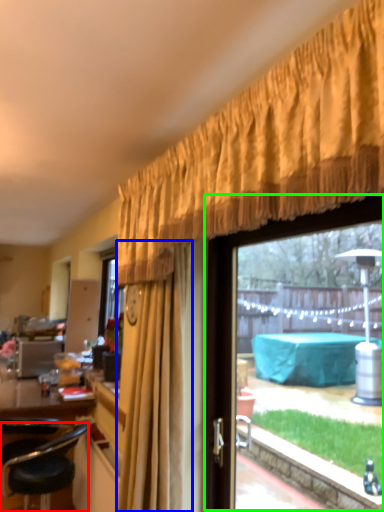
Question: Estimate the real-world distances between objects in this image. Which object is closer to chair (highlighted by a red box), curtain (highlighted by a blue box) or window (highlighted by a green box)?

Choices:
 (A) curtain
 (B) window

Answer: (A)